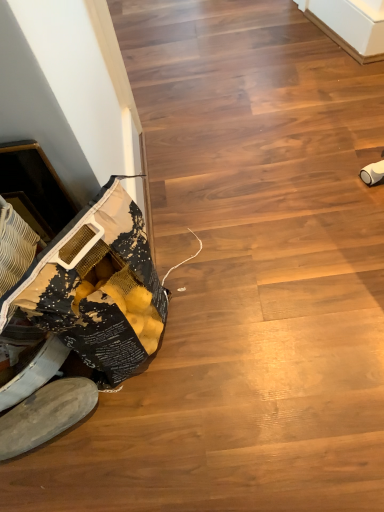
What are the coordinates of `space that is in front of white suede shoe at lower left` in the screenshot? It's located at (63, 476).